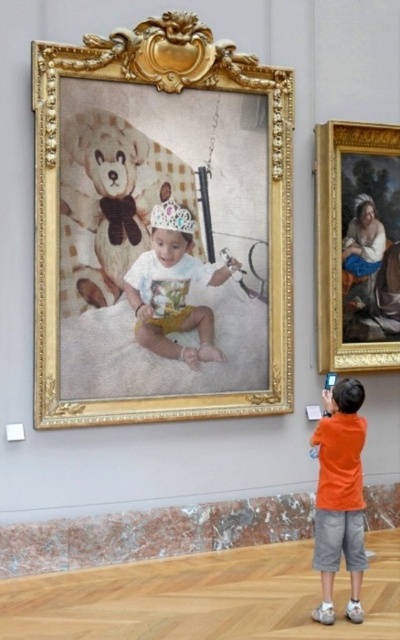
Question: Which object is positioned farthest from the goldmetallicpicture frame at right?

Choices:
 (A) matte white crown at center
 (B) gold ornate frame at upper center
 (C) orange cotton shirt at lower right

Answer: (C)

Question: Does gold ornate frame at upper center appear on the left side of goldmetallicpicture frame at right?

Choices:
 (A) yes
 (B) no

Answer: (A)

Question: Estimate the real-world distances between objects in this image. Which object is farther from the gold ornate frame at upper center?

Choices:
 (A) orange cotton shirt at lower right
 (B) goldmetallicpicture frame at right

Answer: (A)

Question: Which of the following is the closest to the observer?

Choices:
 (A) gold ornate frame at upper center
 (B) goldmetallicpicture frame at right
 (C) orange cotton shirt at lower right
 (D) matte white crown at center

Answer: (C)

Question: Is gold ornate frame at upper center bigger than matte white crown at center?

Choices:
 (A) no
 (B) yes

Answer: (B)

Question: Is the position of goldmetallicpicture frame at right less distant than that of orange cotton shirt at lower right?

Choices:
 (A) yes
 (B) no

Answer: (B)